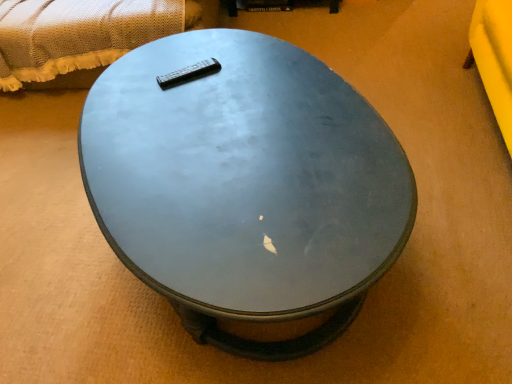
Where is `matte black table at center`? The image size is (512, 384). matte black table at center is located at coordinates (245, 185).

What do you see at coordinates (245, 185) in the screenshot?
I see `matte black table at center` at bounding box center [245, 185].

The image size is (512, 384). Identify the location of matte black table at center. (245, 185).